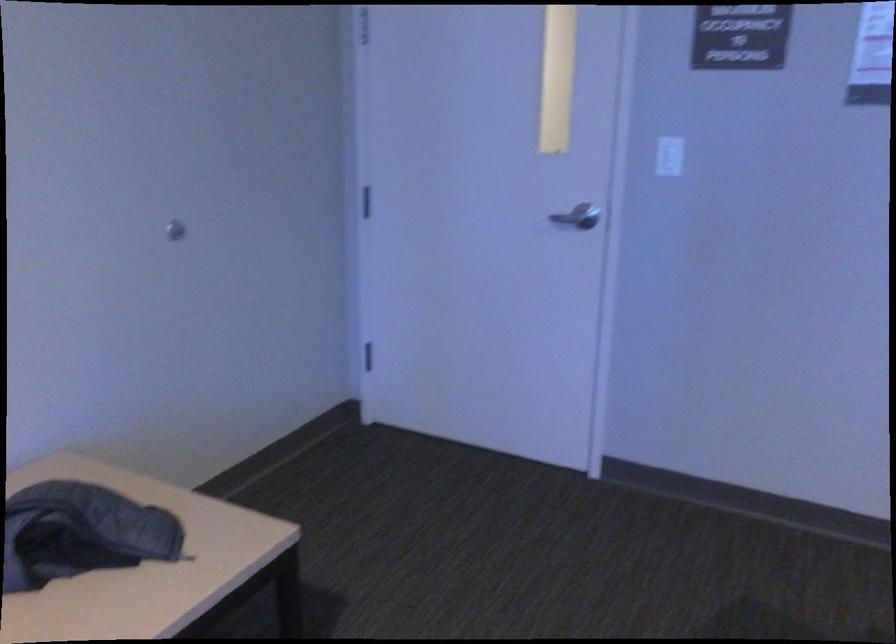
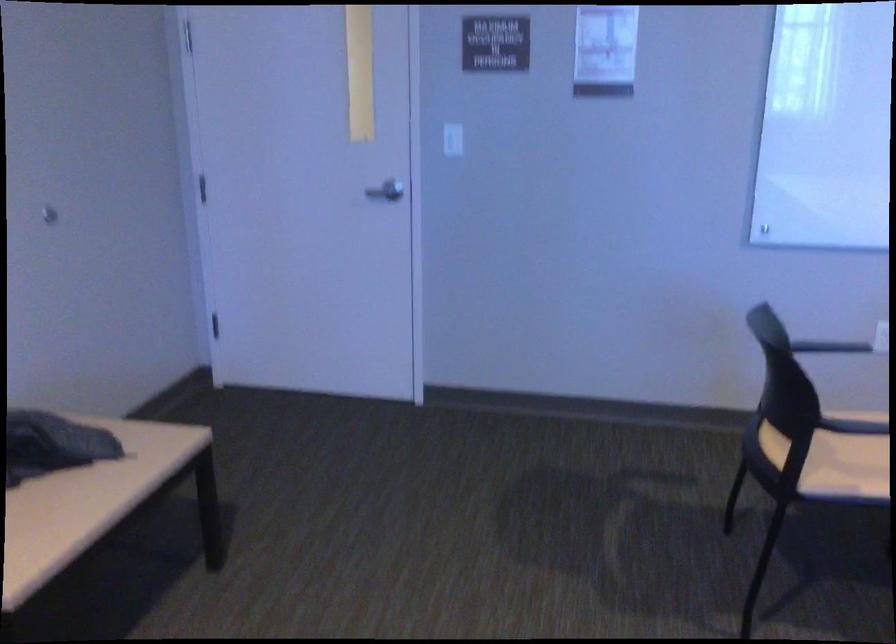
Question: The images are taken continuously from a first-person perspective. In which direction is your viewpoint rotating?

Choices:
 (A) Left
 (B) Right
 (C) Up
 (D) Down

Answer: (B)